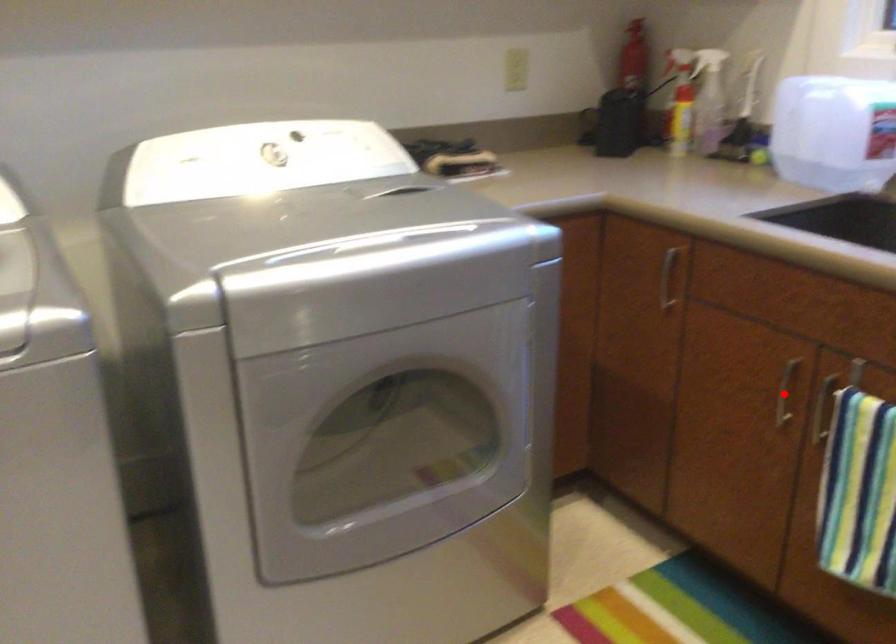
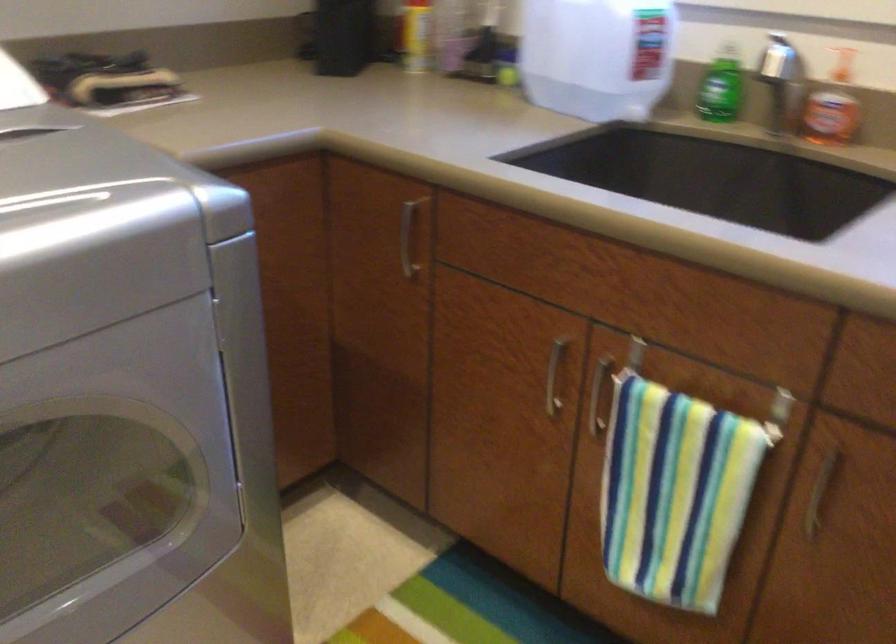
Where in the second image is the point corresponding to the highlighted location from the first image?

(554, 375)